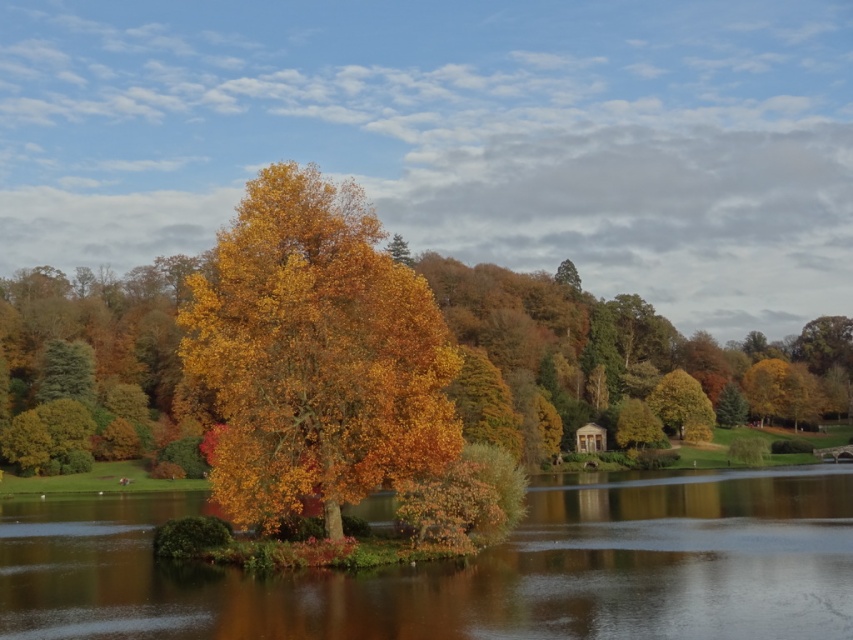
Who is positioned more to the right, transparent water at center or green matte tree at upper right?

green matte tree at upper right is more to the right.

Between transparent water at center and green matte tree at upper right, which one has less height?

With less height is transparent water at center.

What do you see at coordinates (469, 568) in the screenshot?
I see `transparent water at center` at bounding box center [469, 568].

The width and height of the screenshot is (853, 640). In order to click on transparent water at center in this screenshot , I will do `click(469, 568)`.

Is golden matte tree at center smaller than green matte tree at upper right?

No.

Does golden matte tree at center appear under green matte tree at upper right?

No.

Which is behind, point (273, 497) or point (691, 380)?

Point (691, 380)

The width and height of the screenshot is (853, 640). Identify the location of golden matte tree at center. (315, 353).

Does transparent water at center have a greater width compared to golden matte tree at center?

Yes.

Does transparent water at center come behind golden matte tree at center?

No, it is not.

Does point (520, 612) come closer to viewer compared to point (405, 365)?

Yes.

Image resolution: width=853 pixels, height=640 pixels. What are the coordinates of `transparent water at center` in the screenshot? It's located at click(x=469, y=568).